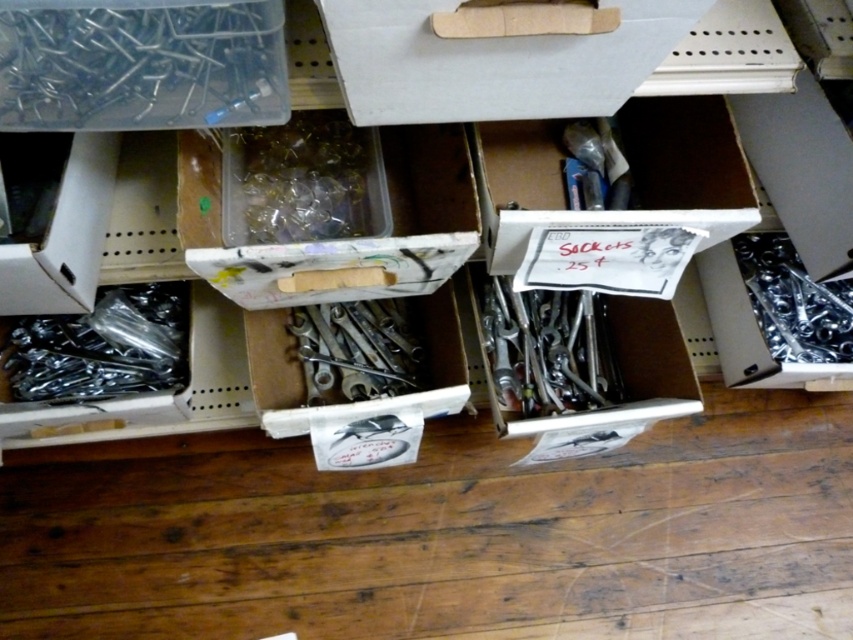
Question: Considering the relative positions of clear plastic nails at upper left and polished silver wrenches at center in the image provided, where is clear plastic nails at upper left located with respect to polished silver wrenches at center?

Choices:
 (A) left
 (B) right

Answer: (A)

Question: Which is nearer to the polished silver wrenches at center?

Choices:
 (A) metallic wrenches at center
 (B) clear plastic nails at upper left
 (C) metallic silver socket at right

Answer: (A)

Question: Does metallic silver wrenches at left have a lesser width compared to metallic silver socket at right?

Choices:
 (A) no
 (B) yes

Answer: (A)

Question: Is metallic silver wrenches at left behind polished silver wrenches at center?

Choices:
 (A) yes
 (B) no

Answer: (B)

Question: Which of the following is the closest to the observer?

Choices:
 (A) (85, 100)
 (B) (91, 323)
 (C) (390, 337)

Answer: (A)

Question: Among these points, which one is farthest from the camera?

Choices:
 (A) (581, 394)
 (B) (22, 102)
 (C) (349, 372)
 (D) (35, 349)

Answer: (A)